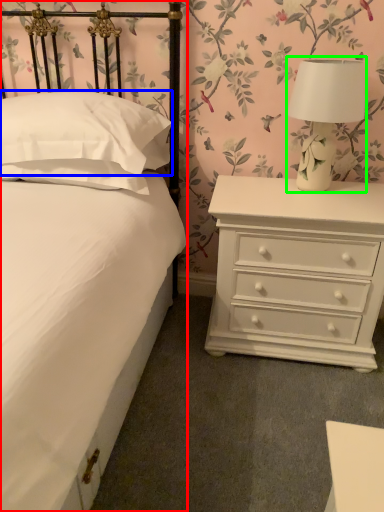
Question: Estimate the real-world distances between objects in this image. Which object is farther from bed (highlighted by a red box), pillow (highlighted by a blue box) or table lamp (highlighted by a green box)?

Choices:
 (A) pillow
 (B) table lamp

Answer: (B)